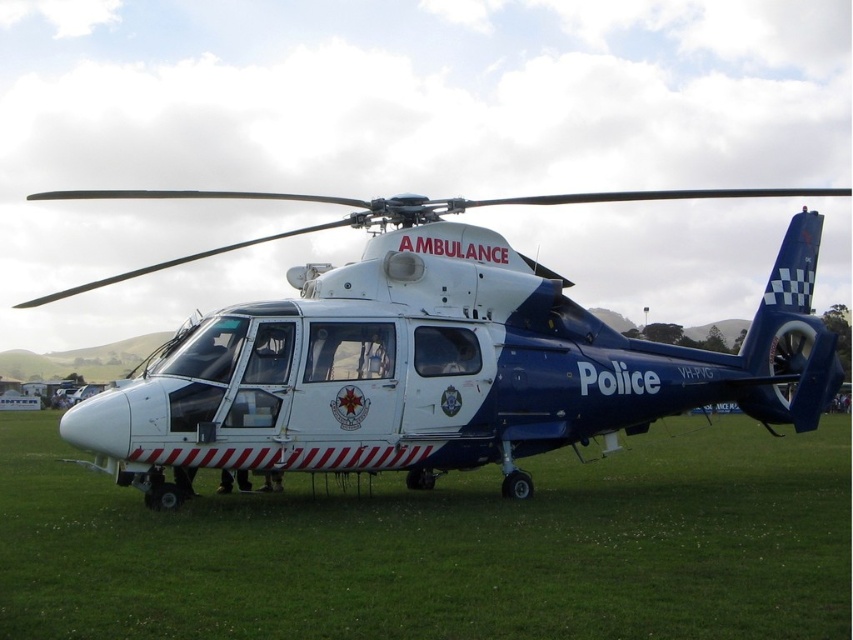
Is green grass at lower center to the left of white glossy helicopter at center from the viewer's perspective?

In fact, green grass at lower center is to the right of white glossy helicopter at center.

From the picture: Does green grass at lower center have a smaller size compared to white glossy helicopter at center?

Indeed, green grass at lower center has a smaller size compared to white glossy helicopter at center.

The image size is (853, 640). Find the location of `green grass at lower center`. green grass at lower center is located at coordinates (444, 548).